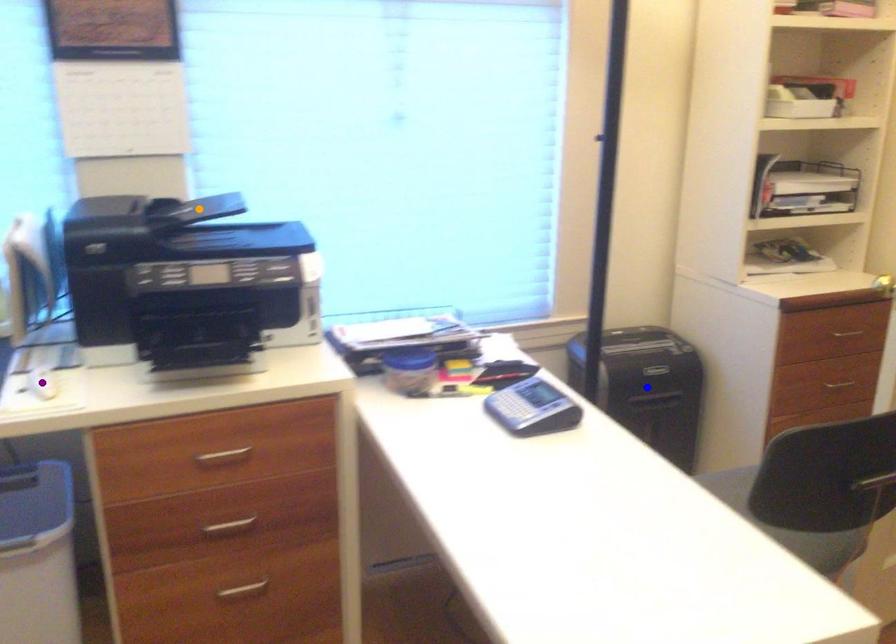
Order these from nearest to farthest:
purple point, blue point, orange point

purple point → orange point → blue point